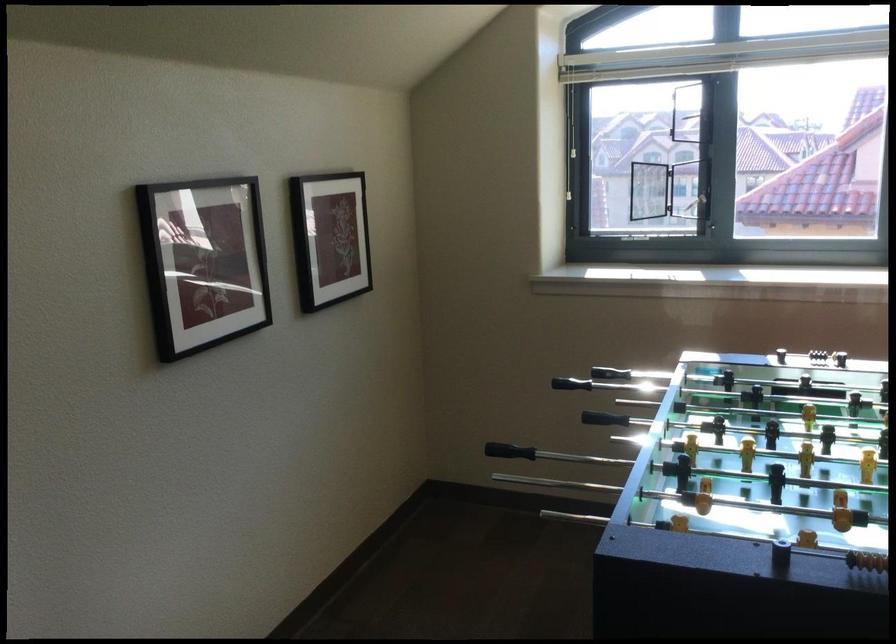
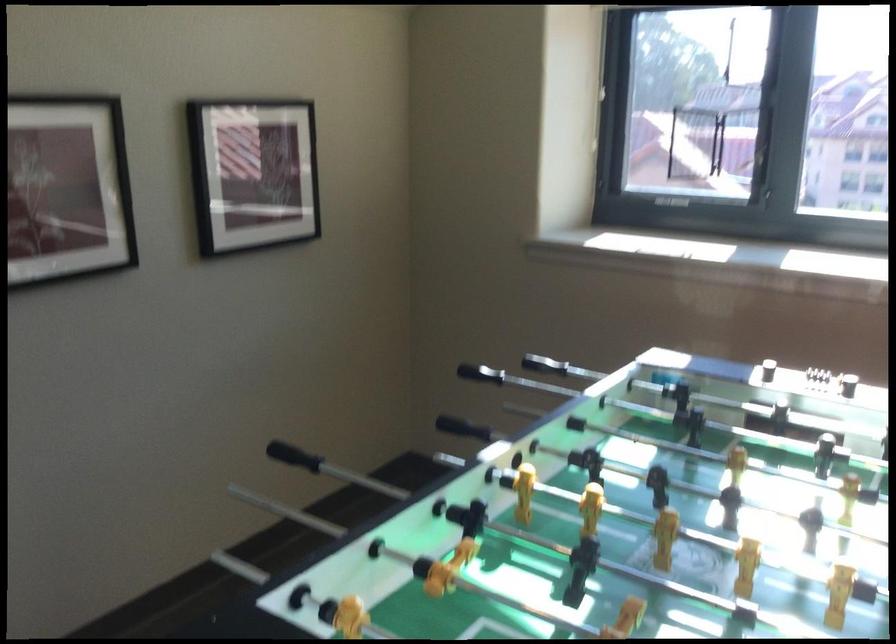
Question: The first image is from the beginning of the video and the second image is from the end. How did the camera likely rotate when shooting the video?

Choices:
 (A) Left
 (B) Right
 (C) Up
 (D) Down

Answer: (A)